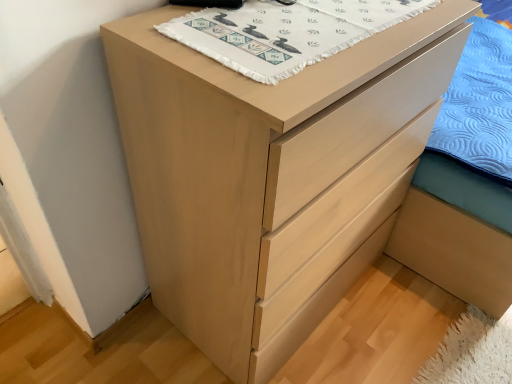
Question: Is light brown wood bed frame at lower right oriented towards white woven cloth at upper center?

Choices:
 (A) yes
 (B) no

Answer: (A)

Question: Is the depth of light brown wood bed frame at lower right less than that of white woven cloth at upper center?

Choices:
 (A) yes
 (B) no

Answer: (B)

Question: From a real-world perspective, is light brown wood bed frame at lower right on white woven cloth at upper center?

Choices:
 (A) no
 (B) yes

Answer: (A)

Question: From the image's perspective, is light brown wood bed frame at lower right above white woven cloth at upper center?

Choices:
 (A) yes
 (B) no

Answer: (A)

Question: Can you confirm if light brown wood bed frame at lower right is thinner than white woven cloth at upper center?

Choices:
 (A) yes
 (B) no

Answer: (B)

Question: From a real-world perspective, is light brown wood bed frame at lower right physically below white woven cloth at upper center?

Choices:
 (A) yes
 (B) no

Answer: (A)

Question: Considering the relative positions of white woven cloth at upper center and light brown wood bed frame at lower right in the image provided, is white woven cloth at upper center to the right of light brown wood bed frame at lower right from the viewer's perspective?

Choices:
 (A) yes
 (B) no

Answer: (B)

Question: From a real-world perspective, is white woven cloth at upper center physically above light brown wood bed frame at lower right?

Choices:
 (A) yes
 (B) no

Answer: (A)

Question: Considering the relative sizes of white woven cloth at upper center and light brown wood bed frame at lower right in the image provided, is white woven cloth at upper center taller than light brown wood bed frame at lower right?

Choices:
 (A) no
 (B) yes

Answer: (A)

Question: Is white woven cloth at upper center to the left of light brown wood bed frame at lower right from the viewer's perspective?

Choices:
 (A) yes
 (B) no

Answer: (A)

Question: Is white woven cloth at upper center wider than light brown wood bed frame at lower right?

Choices:
 (A) no
 (B) yes

Answer: (A)

Question: Is white woven cloth at upper center further to the viewer compared to light brown wood bed frame at lower right?

Choices:
 (A) no
 (B) yes

Answer: (A)

Question: Considering the positions of white woven cloth at upper center and light brown wood bed frame at lower right in the image, is white woven cloth at upper center taller or shorter than light brown wood bed frame at lower right?

Choices:
 (A) short
 (B) tall

Answer: (A)